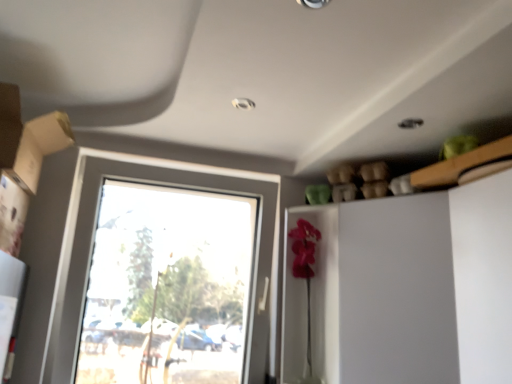
Image resolution: width=512 pixels, height=384 pixels. I want to click on clear glass window at center, so click(167, 277).

The height and width of the screenshot is (384, 512). Describe the element at coordinates (39, 147) in the screenshot. I see `matte cardboard box at left` at that location.

Locate an element on the screen. The width and height of the screenshot is (512, 384). clear glass window at center is located at coordinates (167, 277).

Between matte cardboard box at left and white glossy dresser at right, which one has less height?

With less height is matte cardboard box at left.

From the image's perspective, between matte cardboard box at left and white glossy dresser at right, who is located below?

white glossy dresser at right, from the image's perspective.

Is matte cardboard box at left facing towards white glossy dresser at right?

No, matte cardboard box at left is not facing towards white glossy dresser at right.

From a real-world perspective, is matte cardboard box at left below white glossy dresser at right?

No, from a real-world perspective, matte cardboard box at left is not below white glossy dresser at right.

Which of these two, clear glass window at center or matte cardboard box at left, is wider?

Wider between the two is matte cardboard box at left.

Is clear glass window at center looking in the opposite direction of matte cardboard box at left?

clear glass window at center does not have its back to matte cardboard box at left.

From the image's perspective, relative to matte cardboard box at left, is clear glass window at center above or below?

clear glass window at center is below matte cardboard box at left.

How many degrees apart are the facing directions of clear glass window at center and matte cardboard box at left?

clear glass window at center and matte cardboard box at left are facing 0.74 degrees away from each other.

How different are the orientations of matte cardboard box at left and clear glass window at center in degrees?

matte cardboard box at left and clear glass window at center are facing 0.74 degrees away from each other.

Is matte cardboard box at left facing away from clear glass window at center?

No.

Is point (38, 162) behind point (225, 270)?

No, it is in front of (225, 270).

Which is more to the left, white glossy dresser at right or clear glass window at center?

Result: Positioned to the left is clear glass window at center.

Is white glossy dresser at right placed right next to clear glass window at center?

No, white glossy dresser at right is not beside clear glass window at center.

From the image's perspective, is white glossy dresser at right on top of clear glass window at center?

No, from the image's perspective, white glossy dresser at right is not above clear glass window at center.

Is the surface of white glossy dresser at right in direct contact with matte cardboard box at left?

No.

How much distance is there between white glossy dresser at right and matte cardboard box at left?

A distance of 3.99 feet exists between white glossy dresser at right and matte cardboard box at left.

Considering the relative positions of white glossy dresser at right and matte cardboard box at left in the image provided, is white glossy dresser at right to the left or to the right of matte cardboard box at left?

From the image, it's evident that white glossy dresser at right is to the right of matte cardboard box at left.

Choose the correct answer: Is white glossy dresser at right inside matte cardboard box at left or outside it?

white glossy dresser at right exists outside the volume of matte cardboard box at left.

At what (x,y) coordinates should I click in order to perform the action: click on dresser that appears below the clear glass window at center (from the image's perspective). Please return your answer as a coordinate pair (x, y). The width and height of the screenshot is (512, 384). Looking at the image, I should click on (406, 289).

In terms of width, does clear glass window at center look wider or thinner when compared to white glossy dresser at right?

clear glass window at center is thinner than white glossy dresser at right.

From a real-world perspective, which object stands above the other?

clear glass window at center.

Would you say clear glass window at center is a long distance from white glossy dresser at right?

No, there isn't a large distance between clear glass window at center and white glossy dresser at right.

Find the location of `dresser on the right of matte cardboard box at left`. dresser on the right of matte cardboard box at left is located at coordinates (406, 289).

Where is `cardboard box in front of the clear glass window at center`? The width and height of the screenshot is (512, 384). cardboard box in front of the clear glass window at center is located at coordinates (39, 147).

Looking at the image, which one is located further to white glossy dresser at right, clear glass window at center or matte cardboard box at left?

The object further to white glossy dresser at right is matte cardboard box at left.

Based on their spatial positions, is white glossy dresser at right or matte cardboard box at left further from clear glass window at center?

matte cardboard box at left lies further to clear glass window at center than the other object.

Looking at the image, which one is located further to clear glass window at center, matte cardboard box at left or white glossy dresser at right?

The object further to clear glass window at center is matte cardboard box at left.

Which object lies further to the anchor point matte cardboard box at left, white glossy dresser at right or clear glass window at center?

white glossy dresser at right.

Looking at this image, considering their positions, is matte cardboard box at left positioned closer to white glossy dresser at right than clear glass window at center?

Among the two, clear glass window at center is located nearer to white glossy dresser at right.

Based on their spatial positions, is clear glass window at center or white glossy dresser at right further from matte cardboard box at left?

white glossy dresser at right.

Locate an element on the screen. The height and width of the screenshot is (384, 512). window between matte cardboard box at left and white glossy dresser at right is located at coordinates (167, 277).